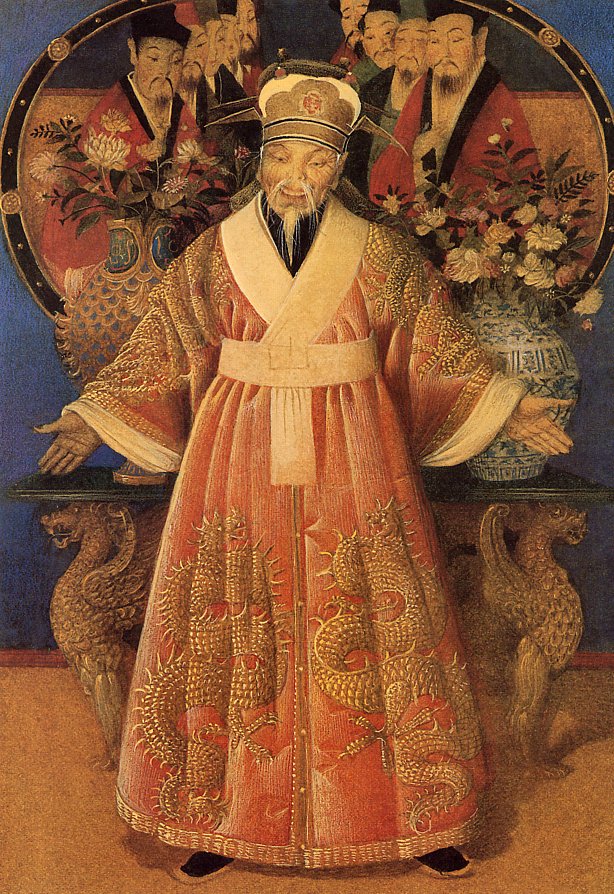
Locate an element on the screen. This screenshot has height=894, width=614. art piece is located at coordinates (258, 702).